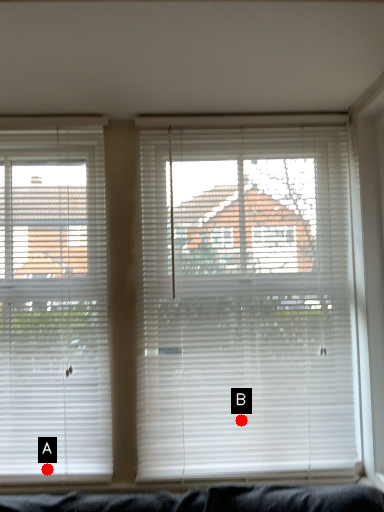
Question: Two points are circled on the image, labeled by A and B beside each circle. Which point is closer to the camera?

Choices:
 (A) A is closer
 (B) B is closer

Answer: (A)